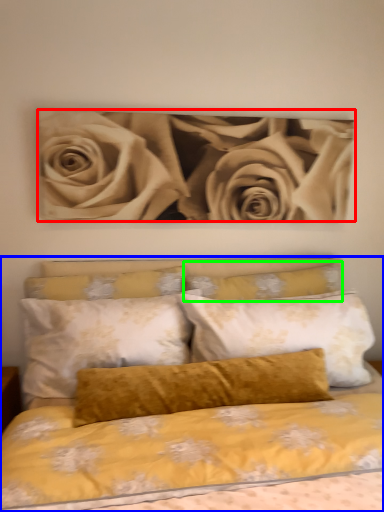
Question: Considering the real-world distances, which object is farthest from rose (highlighted by a red box)? bed (highlighted by a blue box) or pillow (highlighted by a green box)?

Choices:
 (A) bed
 (B) pillow

Answer: (A)